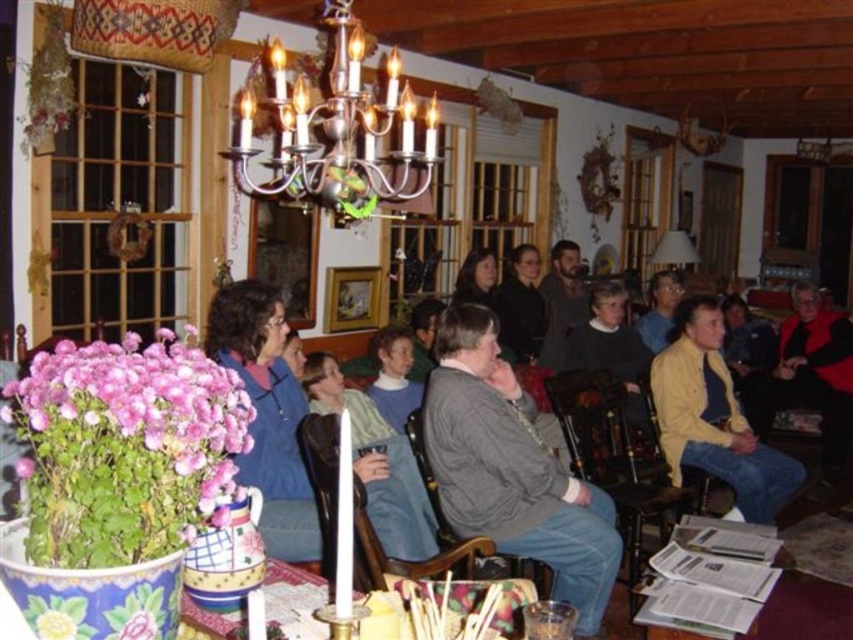
Between gray wool sweater at center and silver/metallic chandelier at upper center, which one appears on the left side from the viewer's perspective?

silver/metallic chandelier at upper center is more to the left.

Who is more distant from viewer, (454, 506) or (415, 147)?

The point (415, 147) is behind.

Where is `gray wool sweater at center`? The height and width of the screenshot is (640, 853). gray wool sweater at center is located at coordinates (512, 468).

Does porcelain vase at center appear on the right side of yellow matte jacket at center?

In fact, porcelain vase at center is to the left of yellow matte jacket at center.

Measure the distance from porcelain vase at center to yellow matte jacket at center.

2.88 meters

Is point (311, 602) closer to camera compared to point (717, 349)?

Yes, point (311, 602) is closer to viewer.

Identify the location of porcelain vase at center. (97, 595).

Between pink fabric flower at lower left and porcelain vase at center, which one has less height?

Standing shorter between the two is porcelain vase at center.

Is pink fabric flower at lower left shorter than porcelain vase at center?

Incorrect, pink fabric flower at lower left's height does not fall short of porcelain vase at center's.

Between point (161, 492) and point (164, 616), which one is positioned in front?

Point (161, 492) is more forward.

The image size is (853, 640). I want to click on pink fabric flower at lower left, so click(125, 448).